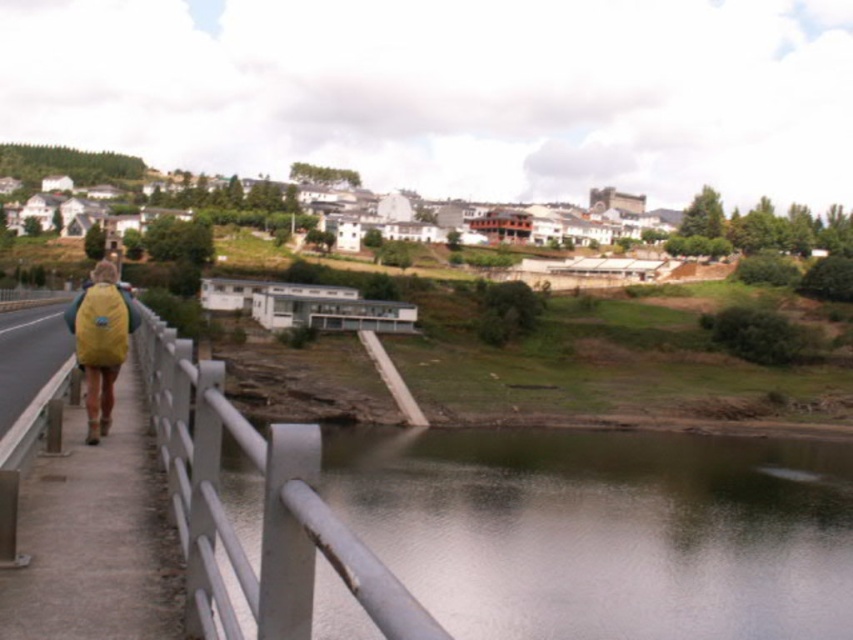
Question: Which object is closer to the camera taking this photo?

Choices:
 (A) white metallic rail at left
 (B) yellow fabric backpack at left
 (C) greenish reflective water at lower center
 (D) concrete sidewalk at left

Answer: (A)

Question: Estimate the real-world distances between objects in this image. Which object is closer to the yellow fabric backpack at left?

Choices:
 (A) greenish reflective water at lower center
 (B) concrete sidewalk at left

Answer: (B)

Question: Is the position of greenish reflective water at lower center less distant than that of yellow fabric backpack at left?

Choices:
 (A) no
 (B) yes

Answer: (B)

Question: Is white metallic rail at left above yellow fabric backpack at left?

Choices:
 (A) no
 (B) yes

Answer: (A)

Question: Which object is closer to the camera taking this photo?

Choices:
 (A) white metallic rail at left
 (B) yellow fabric backpack at left
 (C) greenish reflective water at lower center

Answer: (A)

Question: Is white metallic rail at left wider than yellow fabric backpack at left?

Choices:
 (A) no
 (B) yes

Answer: (B)